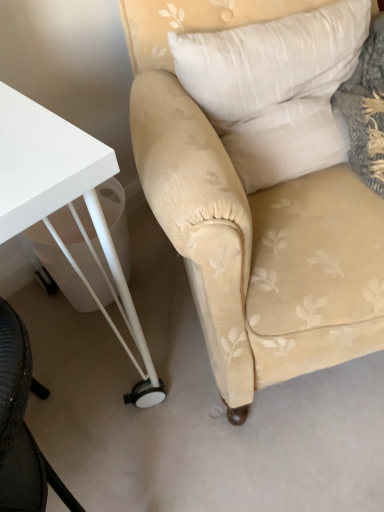
The image size is (384, 512). Describe the element at coordinates (64, 200) in the screenshot. I see `white glossy table at lower left` at that location.

Locate an element on the screen. The height and width of the screenshot is (512, 384). white soft pillow at upper right is located at coordinates (270, 60).

From the image's perspective, which object appears higher, beige fabric chair at center or white glossy table at lower left?

From the image's view, beige fabric chair at center is above.

Consider the image. Is beige fabric chair at center spatially inside white glossy table at lower left, or outside of it?

beige fabric chair at center exists outside the volume of white glossy table at lower left.

Does beige fabric chair at center have a larger size compared to white glossy table at lower left?

Yes.

From a real-world perspective, is beige fabric chair at center physically located above or below white glossy table at lower left?

Clearly, from a real-world perspective, beige fabric chair at center is above white glossy table at lower left.

Is white soft pillow at upper right touching beige fabric chair at center?

They are not placed beside each other.

Considering the relative positions of white soft pillow at upper right and beige fabric chair at center in the image provided, is white soft pillow at upper right in front of beige fabric chair at center?

That is False.

Is white soft pillow at upper right located outside beige fabric chair at center?

No.

How far apart are white soft pillow at upper right and beige fabric chair at center?

8.08 inches.

Does beige fabric chair at center contain white soft pillow at upper right?

Yes, white soft pillow at upper right can be found within beige fabric chair at center.

The height and width of the screenshot is (512, 384). Identify the location of pillow lying on the left of beige fabric chair at center. (270, 60).

Is beige fabric chair at center thinner than white soft pillow at upper right?

In fact, beige fabric chair at center might be wider than white soft pillow at upper right.

From the picture: In terms of width, does white glossy table at lower left look wider or thinner when compared to beige fabric chair at center?

Considering their sizes, white glossy table at lower left looks slimmer than beige fabric chair at center.

Which object is closer to the camera taking this photo, white glossy table at lower left or beige fabric chair at center?

beige fabric chair at center.

From a real-world perspective, is white glossy table at lower left positioned over beige fabric chair at center based on gravity?

No.

Considering the sizes of white glossy table at lower left and beige fabric chair at center in the image, is white glossy table at lower left taller or shorter than beige fabric chair at center?

white glossy table at lower left is shorter than beige fabric chair at center.

Can we say white soft pillow at upper right lies outside white glossy table at lower left?

Absolutely, white soft pillow at upper right is external to white glossy table at lower left.

From the picture: Is white soft pillow at upper right wider or thinner than white glossy table at lower left?

white soft pillow at upper right is thinner than white glossy table at lower left.

Locate an element on the screen. This screenshot has width=384, height=512. pillow positioned vertically above the white glossy table at lower left (from a real-world perspective) is located at coordinates (270, 60).

Which object is further away from the camera taking this photo, white soft pillow at upper right or white glossy table at lower left?

white soft pillow at upper right is more distant.

Is white glossy table at lower left facing towards white soft pillow at upper right?

No, white glossy table at lower left does not turn towards white soft pillow at upper right.

Based on the photo, is white glossy table at lower left thinner than white soft pillow at upper right?

In fact, white glossy table at lower left might be wider than white soft pillow at upper right.

Locate an element on the screen. pillow located on the right of white glossy table at lower left is located at coordinates (270, 60).

Where is `table on the left of the beige fabric chair at center`? Image resolution: width=384 pixels, height=512 pixels. table on the left of the beige fabric chair at center is located at coordinates (64, 200).

You are a GUI agent. You are given a task and a screenshot of the screen. Output one action in this format:
    pyautogui.click(x=<x>, y=<y>)
    Task: Click on the chair in front of the white soft pillow at upper right
    This screenshot has height=512, width=384.
    Given the screenshot: What is the action you would take?
    pyautogui.click(x=237, y=212)

Looking at the image, which one is located further to beige fabric chair at center, white glossy table at lower left or white soft pillow at upper right?

Among the two, white glossy table at lower left is located further to beige fabric chair at center.

Based on their spatial positions, is white soft pillow at upper right or white glossy table at lower left closer to beige fabric chair at center?

white soft pillow at upper right.

Based on their spatial positions, is beige fabric chair at center or white glossy table at lower left further from white soft pillow at upper right?

Among the two, white glossy table at lower left is located further to white soft pillow at upper right.

Estimate the real-world distances between objects in this image. Which object is closer to white soft pillow at upper right, white glossy table at lower left or beige fabric chair at center?

Based on the image, beige fabric chair at center appears to be nearer to white soft pillow at upper right.

When comparing their distances from white glossy table at lower left, does beige fabric chair at center or white soft pillow at upper right seem closer?

beige fabric chair at center is closer to white glossy table at lower left.

Estimate the real-world distances between objects in this image. Which object is closer to white glossy table at lower left, white soft pillow at upper right or beige fabric chair at center?

Based on the image, beige fabric chair at center appears to be nearer to white glossy table at lower left.

Identify the location of pillow situated between white glossy table at lower left and beige fabric chair at center from left to right. (270, 60).